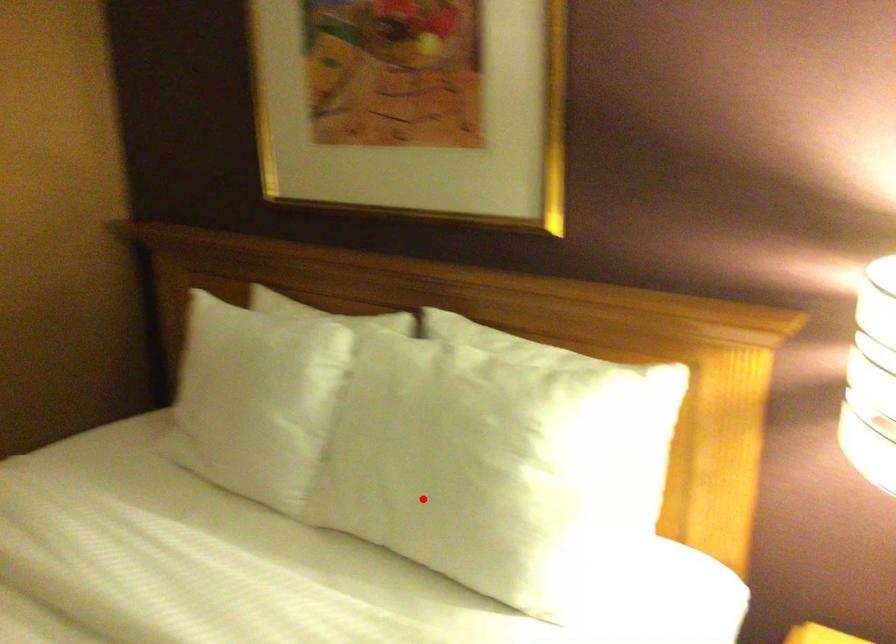
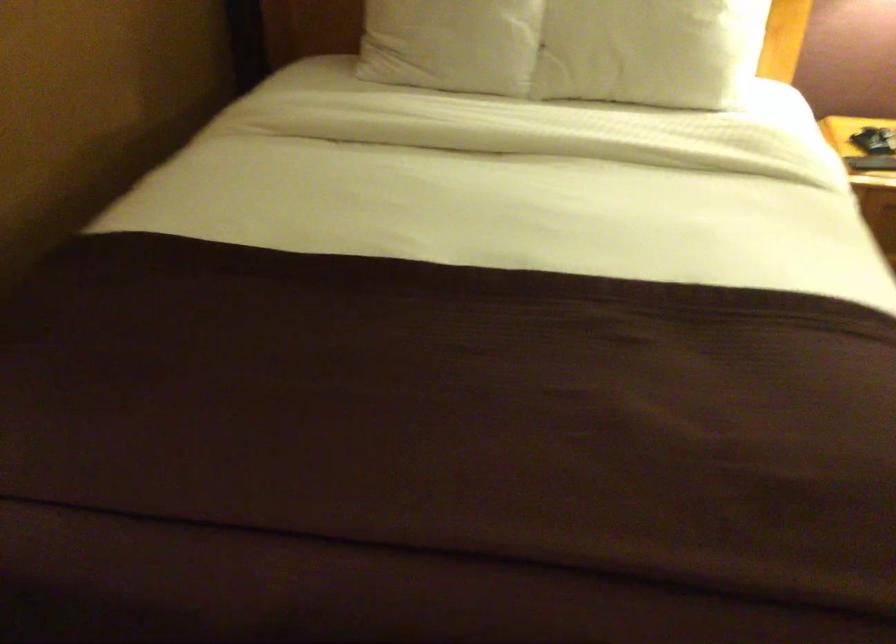
Question: A red point is marked in image1. In image2, is the corresponding 3D point closer to the camera or farther? Reply with the corresponding letter.

Choices:
 (A) The corresponding 3D point is closer.
 (B) The corresponding 3D point is farther.

Answer: (B)